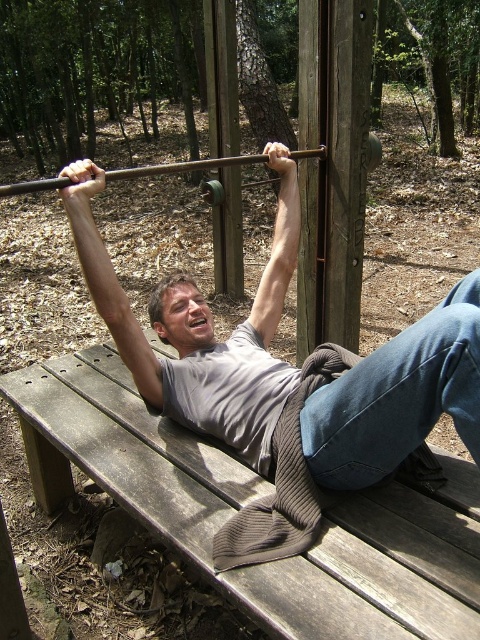
Consider the image. Which is more to the left, wooden bench at center or wooden barbell at center?

From the viewer's perspective, wooden barbell at center appears more on the left side.

Is point (170, 424) in front of point (309, 148)?

Yes, point (170, 424) is in front of point (309, 148).

At what (x,y) coordinates should I click in order to perform the action: click on wooden bench at center. Please return your answer as a coordinate pair (x, y). The width and height of the screenshot is (480, 640). Looking at the image, I should click on (252, 499).

Is point (56, 444) positioned in front of point (253, 416)?

No, (56, 444) is behind (253, 416).

Between point (385, 605) and point (294, 186), which one is positioned in front?

Positioned in front is point (385, 605).

This screenshot has width=480, height=640. Identify the location of wooden bench at center. (252, 499).

Who is higher up, gray matte shirt at center or wooden barbell at center?

wooden barbell at center is higher up.

Based on the photo, between gray matte shirt at center and wooden barbell at center, which one is positioned lower?

gray matte shirt at center is below.

Is point (262, 445) closer to camera compared to point (47, 179)?

Yes.

The height and width of the screenshot is (640, 480). What are the coordinates of `gray matte shirt at center` in the screenshot? It's located at (199, 324).